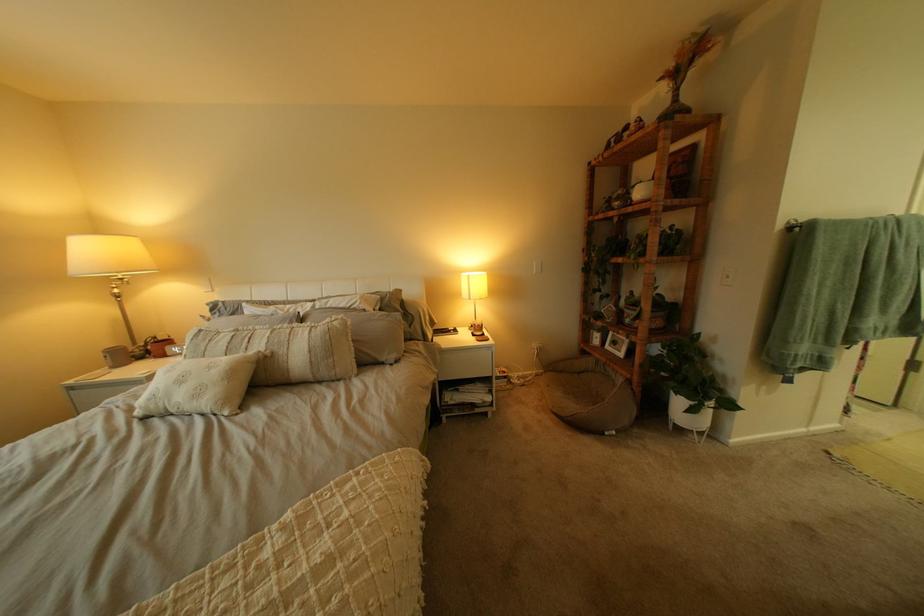
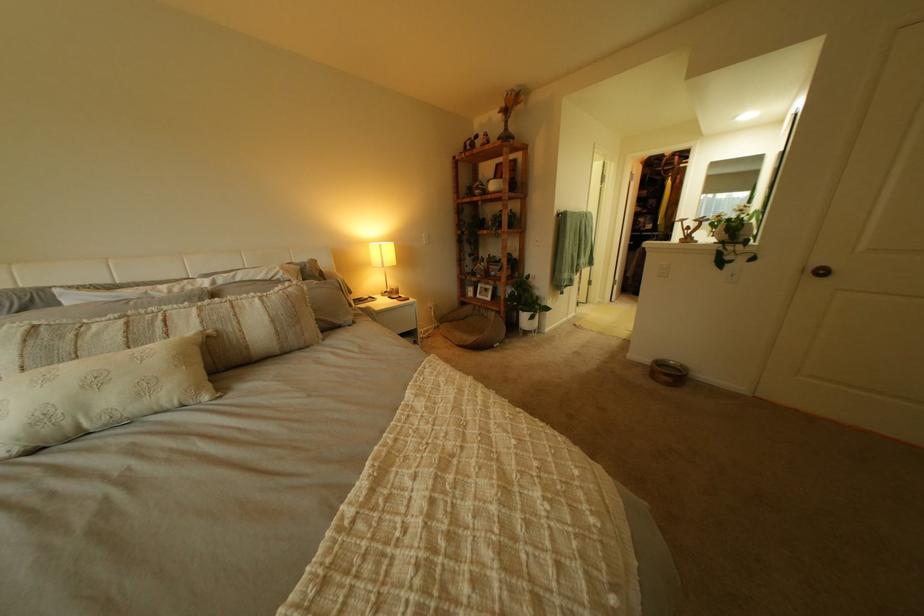
Where in the second image is the point corresponding to point 176,405 from the first image?

(80, 424)